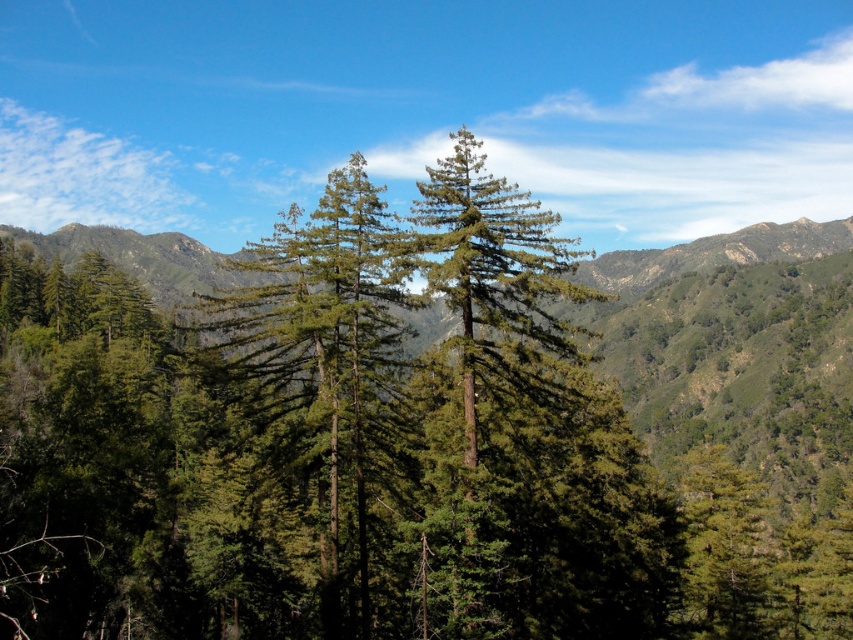
You are standing at the point marked as point (x=314, y=420) in the image. What object is located exactly at that point?

The green matte tree at center is located exactly at point (x=314, y=420).